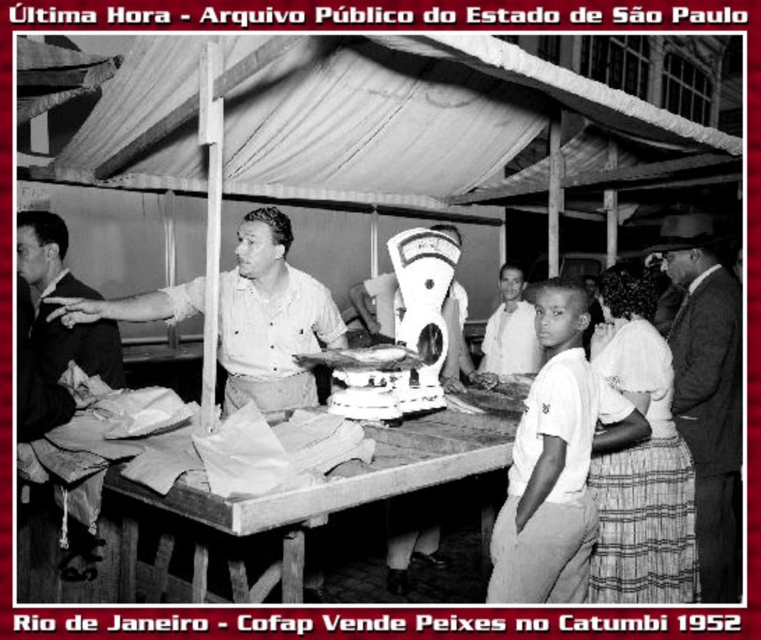
Is point (556, 461) positioned behind point (591, 602)?

No.

This screenshot has height=640, width=761. Find the location of `white cotton shirt at center`. white cotton shirt at center is located at coordinates (556, 460).

Image resolution: width=761 pixels, height=640 pixels. I want to click on white cotton shirt at center, so click(x=556, y=460).

Between smooth dark suit at right and matte white shirt at center, which one appears on the left side from the viewer's perspective?

matte white shirt at center

Between smooth dark suit at right and matte white shirt at center, which one appears on the right side from the viewer's perspective?

smooth dark suit at right

Locate an element on the screen. smooth dark suit at right is located at coordinates (705, 392).

Is striped cotton skirt at lower right positioned before smooth dark suit at right?

Yes, striped cotton skirt at lower right is closer to the viewer.

From the picture: Is striped cotton skirt at lower right smaller than smooth dark suit at right?

Indeed, striped cotton skirt at lower right has a smaller size compared to smooth dark suit at right.

Locate an element on the screen. striped cotton skirt at lower right is located at coordinates (639, 456).